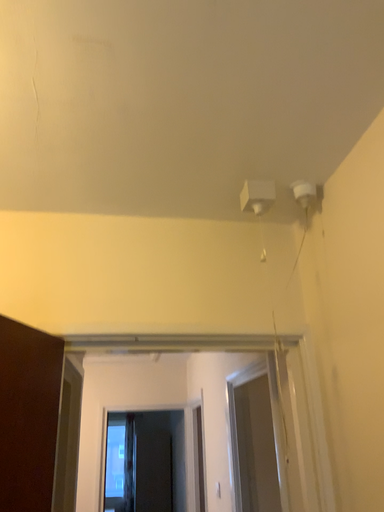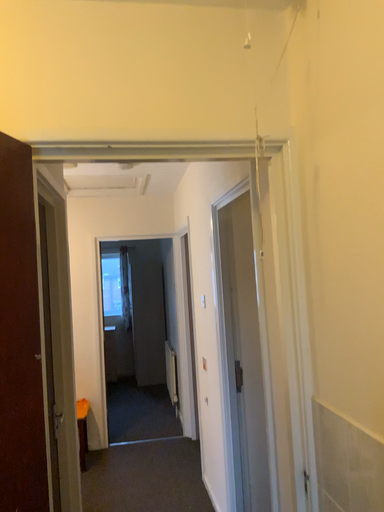
Question: Which way did the camera rotate in the video?

Choices:
 (A) rotated downward
 (B) rotated upward

Answer: (A)